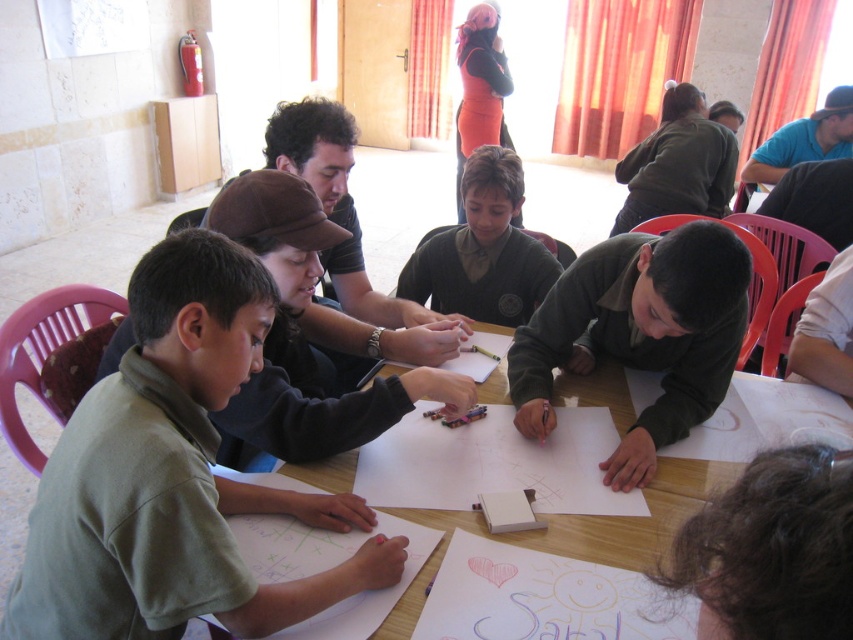
You are a photographer positioned in front of the table where the children are drawing. You want to take a photo that includes both the matte black shirt at upper center and the blue shirt at upper right. Which shirt should you focus on first to ensure both are in frame?

The matte black shirt at upper center is taller than the blue shirt at upper right, so you should focus on the matte black shirt at upper center first to ensure both are in frame.